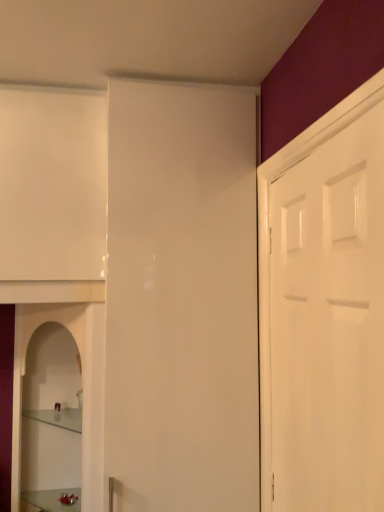
Question: Considering the relative positions of clear glass shelf at lower left and clear glass cabinet at lower left in the image provided, is clear glass shelf at lower left to the left of clear glass cabinet at lower left from the viewer's perspective?

Choices:
 (A) no
 (B) yes

Answer: (A)

Question: From a real-world perspective, does clear glass shelf at lower left sit lower than clear glass cabinet at lower left?

Choices:
 (A) yes
 (B) no

Answer: (A)

Question: From the image's perspective, does clear glass shelf at lower left appear higher than clear glass cabinet at lower left?

Choices:
 (A) no
 (B) yes

Answer: (A)

Question: Is clear glass shelf at lower left not within clear glass cabinet at lower left?

Choices:
 (A) yes
 (B) no

Answer: (B)

Question: From a real-world perspective, is clear glass shelf at lower left positioned over clear glass cabinet at lower left based on gravity?

Choices:
 (A) no
 (B) yes

Answer: (A)

Question: Can you confirm if clear glass shelf at lower left is wider than clear glass cabinet at lower left?

Choices:
 (A) yes
 (B) no

Answer: (B)

Question: Does clear glass shelf at lower left have a lesser height compared to white glossy door at right?

Choices:
 (A) yes
 (B) no

Answer: (A)

Question: Can you confirm if clear glass shelf at lower left is wider than white glossy door at right?

Choices:
 (A) no
 (B) yes

Answer: (B)

Question: Considering the relative positions of clear glass shelf at lower left and white glossy door at right in the image provided, is clear glass shelf at lower left to the left of white glossy door at right from the viewer's perspective?

Choices:
 (A) no
 (B) yes

Answer: (B)

Question: Is clear glass shelf at lower left closer to camera compared to white glossy door at right?

Choices:
 (A) no
 (B) yes

Answer: (A)

Question: Is clear glass shelf at lower left bigger than white glossy door at right?

Choices:
 (A) yes
 (B) no

Answer: (B)

Question: Would you consider clear glass shelf at lower left to be distant from white glossy door at right?

Choices:
 (A) no
 (B) yes

Answer: (B)

Question: From the image's perspective, is white glossy door at right located beneath clear glass shelf at lower left?

Choices:
 (A) yes
 (B) no

Answer: (B)